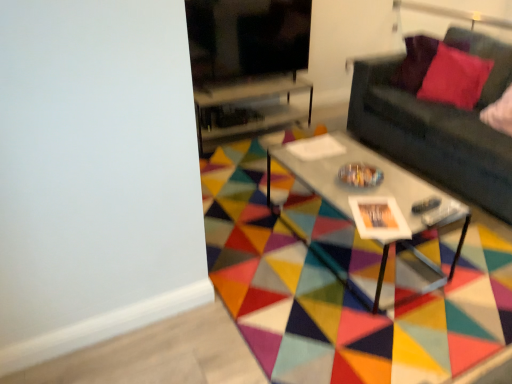
What do you see at coordinates (423, 61) in the screenshot? The image size is (512, 384). I see `velvet red pillow at upper right` at bounding box center [423, 61].

Locate an element on the screen. The image size is (512, 384). velvet red pillow at upper right is located at coordinates (455, 77).

Measure the distance between point [460,66] and camera.

They are 10.10 feet apart.

I want to click on transparent glass table at center, so point(247,109).

Based on the photo, measure the distance between transparent glass table at center and camera.

A distance of 3.12 meters exists between transparent glass table at center and camera.

The image size is (512, 384). What are the coordinates of `geometric multicolored rug at center` in the screenshot? It's located at (341, 284).

Where is `velvet red pillow at upper right`? The height and width of the screenshot is (384, 512). velvet red pillow at upper right is located at coordinates (423, 61).

Is transparent glass table at center at the back of metallic gray coffee table at center?

That's right, metallic gray coffee table at center is facing away from transparent glass table at center.

Considering the relative positions of metallic gray coffee table at center and transparent glass table at center in the image provided, is metallic gray coffee table at center to the left of transparent glass table at center from the viewer's perspective?

Incorrect, metallic gray coffee table at center is not on the left side of transparent glass table at center.

Is metallic gray coffee table at center positioned beyond the bounds of transparent glass table at center?

Yes, metallic gray coffee table at center is located beyond the bounds of transparent glass table at center.

Does point (410, 173) come farther from viewer compared to point (223, 119)?

No, it is in front of (223, 119).

Are velvet red pillow at upper right and metallic gray coffee table at center located far from each other?

Yes.

Considering the relative sizes of velvet red pillow at upper right and metallic gray coffee table at center in the image provided, is velvet red pillow at upper right wider than metallic gray coffee table at center?

Incorrect, the width of velvet red pillow at upper right does not surpass that of metallic gray coffee table at center.

Can you confirm if velvet red pillow at upper right is shorter than metallic gray coffee table at center?

No.

Considering the points (408, 51) and (282, 162), which point is behind, point (408, 51) or point (282, 162)?

Point (408, 51)

Do you think dark gray fabric couch at right is within geometric multicolored rug at center, or outside of it?

The correct answer is: outside.

From the image's perspective, is dark gray fabric couch at right on geometric multicolored rug at center?

Indeed, from the image's perspective, dark gray fabric couch at right is shown above geometric multicolored rug at center.

Can you confirm if dark gray fabric couch at right is shorter than geometric multicolored rug at center?

Incorrect, the height of dark gray fabric couch at right does not fall short of that of geometric multicolored rug at center.

From a real-world perspective, does dark gray fabric couch at right stand above transparent glass table at center?

Correct, in the physical world, dark gray fabric couch at right is higher than transparent glass table at center.

Relative to transparent glass table at center, is dark gray fabric couch at right in front or behind?

Clearly, dark gray fabric couch at right is in front of transparent glass table at center.

Considering the sizes of objects dark gray fabric couch at right and transparent glass table at center in the image provided, who is thinner, dark gray fabric couch at right or transparent glass table at center?

transparent glass table at center is thinner.

Is dark gray fabric couch at right outside of transparent glass table at center?

Yes, dark gray fabric couch at right is located beyond the bounds of transparent glass table at center.

In the image, there is a velvet red pillow at upper right. Identify the location of studio couch below it (from the image's perspective). The width and height of the screenshot is (512, 384). (439, 125).

From the image's perspective, which one is positioned lower, velvet red pillow at upper right or dark gray fabric couch at right?

dark gray fabric couch at right, from the image's perspective.

Is velvet red pillow at upper right thinner than dark gray fabric couch at right?

Yes.

Visually, is geometric multicolored rug at center positioned to the left or to the right of metallic gray coffee table at center?

From the image, it's evident that geometric multicolored rug at center is to the left of metallic gray coffee table at center.

Are geometric multicolored rug at center and metallic gray coffee table at center beside each other?

No, geometric multicolored rug at center is not beside metallic gray coffee table at center.

Is point (350, 370) closer or farther from the camera than point (436, 197)?

Point (350, 370).

From the picture: Measure the distance from geometric multicolored rug at center to metallic gray coffee table at center.

A distance of 15.97 inches exists between geometric multicolored rug at center and metallic gray coffee table at center.

How many degrees apart are the facing directions of velvet red pillow at upper right and geometric multicolored rug at center?

The angular difference between velvet red pillow at upper right and geometric multicolored rug at center is 48 degrees.

Looking at this image, from the image's perspective, is velvet red pillow at upper right below geometric multicolored rug at center?

Actually, velvet red pillow at upper right appears above geometric multicolored rug at center in the image.

From the picture: Would you say velvet red pillow at upper right is a long distance from geometric multicolored rug at center?

Indeed, velvet red pillow at upper right is not near geometric multicolored rug at center.

From a real-world perspective, who is located lower, velvet red pillow at upper right or geometric multicolored rug at center?

In real-world perspective, geometric multicolored rug at center is lower.

What are the coordinates of `coffee table that appears below the transparent glass table at center (from the image's perspective)` in the screenshot? It's located at (368, 188).

At what (x,y) coordinates should I click in order to perform the action: click on coffee table beneath the velvet red pillow at upper right (from a real-world perspective). Please return your answer as a coordinate pair (x, y). Looking at the image, I should click on (368, 188).

From the image, which object appears to be farther from geometric multicolored rug at center, velvet red pillow at upper right or dark gray fabric couch at right?

velvet red pillow at upper right lies further to geometric multicolored rug at center than the other object.

When comparing their distances from dark gray fabric couch at right, does geometric multicolored rug at center or transparent glass table at center seem further?

transparent glass table at center lies further to dark gray fabric couch at right than the other object.

From the picture: Considering their positions, is velvet red pillow at upper right positioned closer to transparent glass table at center than dark gray fabric couch at right?

dark gray fabric couch at right.

When comparing their distances from velvet red pillow at upper right, does transparent glass table at center or dark gray fabric couch at right seem further?

transparent glass table at center is further to velvet red pillow at upper right.

Based on their spatial positions, is velvet red pillow at upper right or geometric multicolored rug at center closer to transparent glass table at center?

The object closer to transparent glass table at center is geometric multicolored rug at center.

In the scene shown: Which object lies further to the anchor point geometric multicolored rug at center, dark gray fabric couch at right or transparent glass table at center?

transparent glass table at center.

Looking at this image, which object lies further to the anchor point metallic gray coffee table at center, velvet red pillow at upper right or geometric multicolored rug at center?

Among the two, velvet red pillow at upper right is located further to metallic gray coffee table at center.

From the image, which object appears to be farther from dark gray fabric couch at right, geometric multicolored rug at center or velvet red pillow at upper right?

geometric multicolored rug at center.

The width and height of the screenshot is (512, 384). Identify the location of coffee table located between transparent glass table at center and dark gray fabric couch at right in the left-right direction. (368, 188).

Where is `studio couch located between metallic gray coffee table at center and velvet red pillow at upper right in the depth direction`? studio couch located between metallic gray coffee table at center and velvet red pillow at upper right in the depth direction is located at coordinates (439, 125).

Image resolution: width=512 pixels, height=384 pixels. What are the coordinates of `coffee table positioned between geometric multicolored rug at center and velvet red pillow at upper right from near to far` in the screenshot? It's located at (368, 188).

Locate an element on the screen. Image resolution: width=512 pixels, height=384 pixels. pillow between transparent glass table at center and velvet red pillow at upper right from left to right is located at coordinates (423, 61).